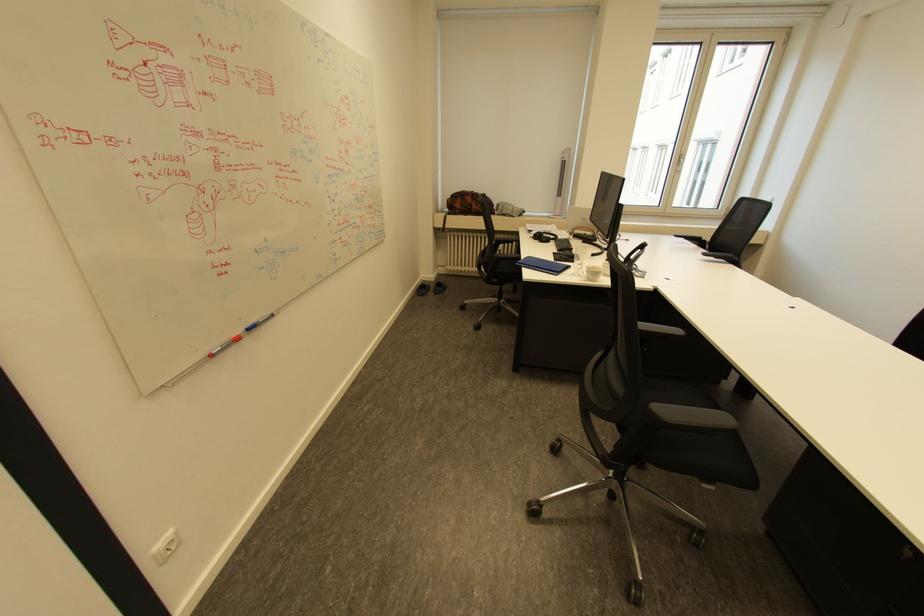
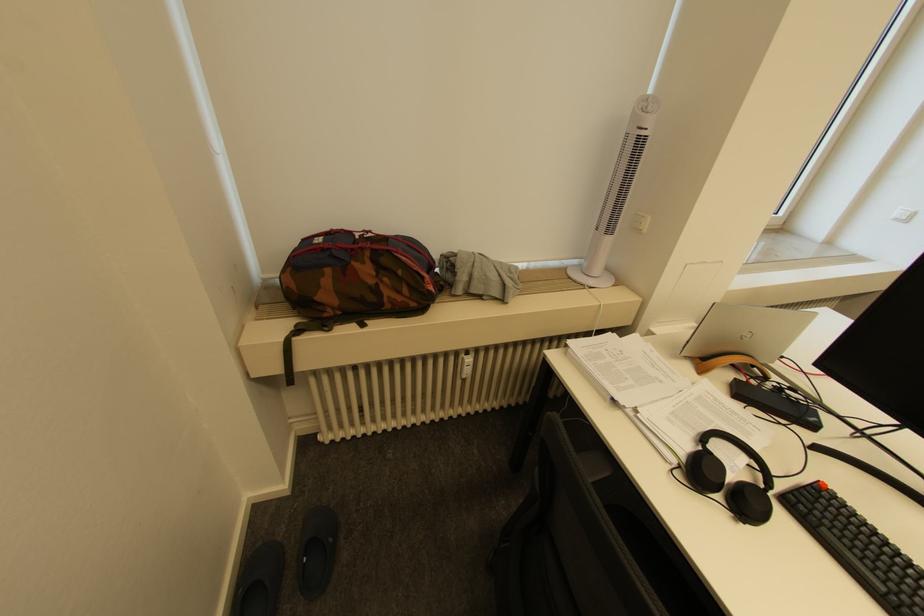
Question: The images are taken continuously from a first-person perspective. In which direction are you moving?

Choices:
 (A) Left
 (B) Right
 (C) Forward
 (D) Backward

Answer: (C)